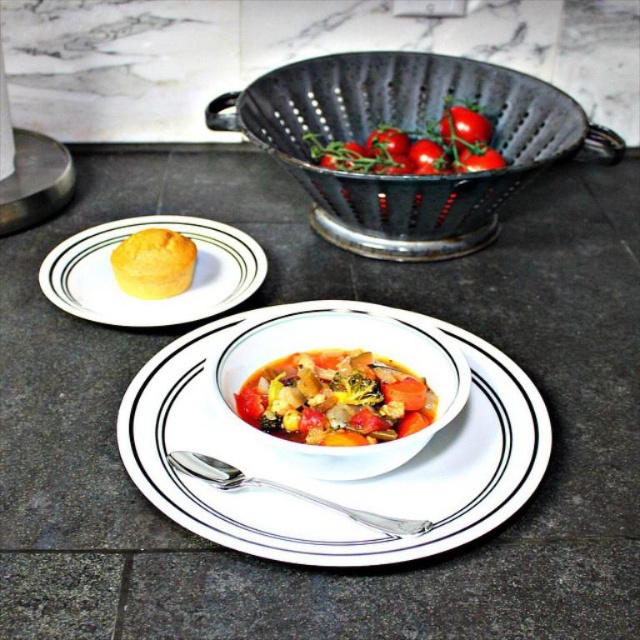
Which of these two, vibrant mixed vegetable stew at center or red matte tomato at upper center, stands taller?

Standing taller between the two is red matte tomato at upper center.

Consider the image. Does vibrant mixed vegetable stew at center appear on the right side of red matte tomato at upper center?

Incorrect, vibrant mixed vegetable stew at center is not on the right side of red matte tomato at upper center.

This screenshot has height=640, width=640. Describe the element at coordinates (336, 397) in the screenshot. I see `vibrant mixed vegetable stew at center` at that location.

At what (x,y) coordinates should I click in order to perform the action: click on vibrant mixed vegetable stew at center. Please return your answer as a coordinate pair (x, y). This screenshot has height=640, width=640. Looking at the image, I should click on point(336,397).

Which is more to the left, white glossy plate at center or glossy red tomato at upper right?

From the viewer's perspective, white glossy plate at center appears more on the left side.

Does white glossy plate at center appear on the left side of glossy red tomato at upper right?

Correct, you'll find white glossy plate at center to the left of glossy red tomato at upper right.

Between point (333, 493) and point (481, 170), which one is positioned in front?

Point (333, 493) is in front.

Image resolution: width=640 pixels, height=640 pixels. What are the coordinates of `white glossy plate at center` in the screenshot? It's located at (332, 481).

From the picture: Does white glossy bowl at center lie behind yellow matte muffin at upper left?

No, white glossy bowl at center is closer to the viewer.

What do you see at coordinates (340, 346) in the screenshot? The image size is (640, 640). I see `white glossy bowl at center` at bounding box center [340, 346].

Find the location of `white glossy bowl at center`. white glossy bowl at center is located at coordinates (340, 346).